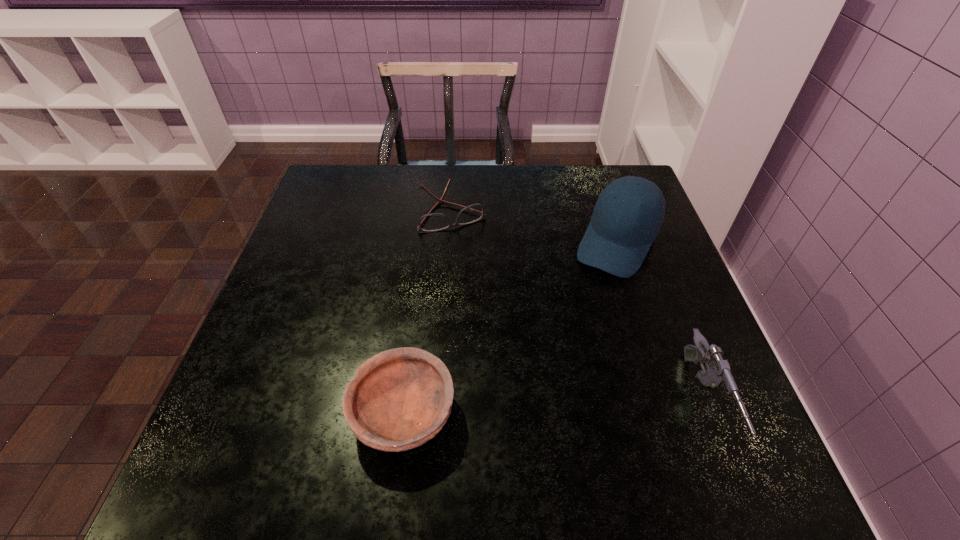
The image size is (960, 540). I want to click on free space between the tallest object and the second shortest object, so click(511, 328).

You are a GUI agent. You are given a task and a screenshot of the screen. Output one action in this format:
    pyautogui.click(x=<x>, y=<y>)
    Task: Click on the free space between the tallest object and the third shortest object
    This screenshot has height=540, width=960.
    Given the screenshot: What is the action you would take?
    pyautogui.click(x=660, y=322)

I want to click on vacant region between the spectacles and the baseball cap, so pyautogui.click(x=536, y=227).

Where is `empty location between the shortest object and the bowl`? empty location between the shortest object and the bowl is located at coordinates (429, 313).

Where is `blank region between the spectacles and the tallest object`? The width and height of the screenshot is (960, 540). blank region between the spectacles and the tallest object is located at coordinates (536, 227).

In order to click on unoccupied position between the baseball cap and the gun in this screenshot , I will do `click(660, 322)`.

At what (x,y) coordinates should I click in order to perform the action: click on the closest object to the bowl. Please return your answer as a coordinate pair (x, y). Image resolution: width=960 pixels, height=540 pixels. Looking at the image, I should click on (629, 212).

Locate which object ranks in proximity to the gun. Please provide its 2D coordinates. Your answer should be formatted as a tuple, i.e. [(x, y)], where the tuple contains the x and y coordinates of a point satisfying the conditions above.

[(629, 212)]

This screenshot has height=540, width=960. Find the location of `vacant space that satisfies the following two spatial constraints: 1. on the front side of the shortest object; 2. on the left side of the baseball cap`. vacant space that satisfies the following two spatial constraints: 1. on the front side of the shortest object; 2. on the left side of the baseball cap is located at coordinates (451, 243).